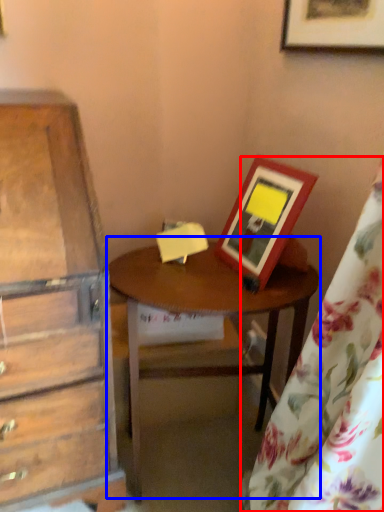
Question: Which object appears farthest to the camera in this image, curtain (highlighted by a red box) or table (highlighted by a blue box)?

Choices:
 (A) curtain
 (B) table

Answer: (B)